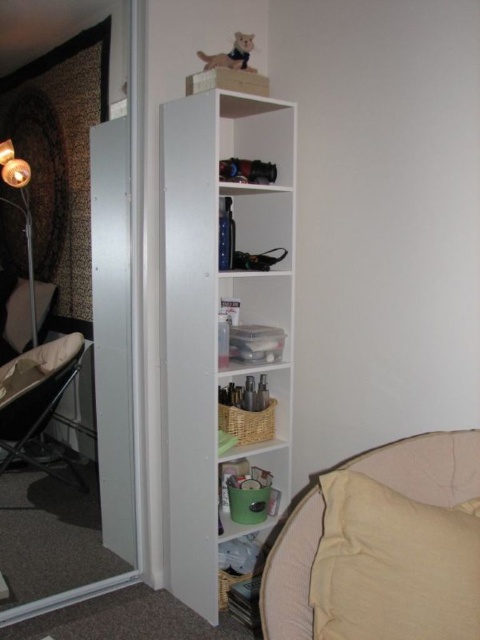
In the scene shown: You are a guest in this room and want to place a small book on the beige fabric pillow at lower right. However, you notice the matte gold lamp at left might be in the way. Is the lamp above or below the pillow?

The beige fabric pillow at lower right is below the matte gold lamp at left, so the lamp is above the pillow.

You need to place a 1.2 meter long ladder in this room. The ladder requires 1 meter of space in front of it. Given the metallic silver folding chair at left and the matte gold lamp at left are both in the way, which object should you move to make space?

The metallic silver folding chair at left is larger than the matte gold lamp at left, so you should move the metallic silver folding chair at left to make space for the ladder.

You are moving a large painting that is 1.2 meters tall. You want to place it on the wall where the white matte bookshelf at center and the matte gold lamp at left are located. Can the painting fit vertically between these two items?

The white matte bookshelf at center is below the matte gold lamp at left, so the vertical space between them is the height of the bookshelf plus the distance between them. Since the painting is 1.2 meters tall, it depends on whether the combined height and spacing exceed 1.2 meters. However, without exact measurements, we cannot confirm. But since the bookshelf is tall and the lamp is above it, it might be possible if the total vertical space is sufficient.